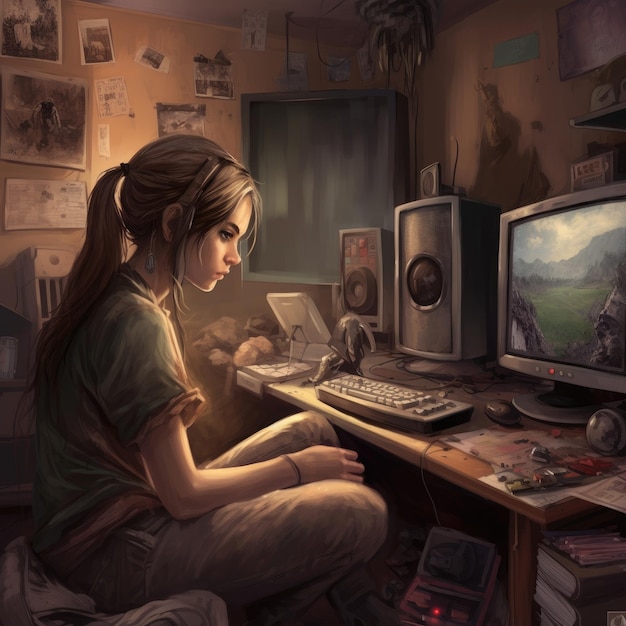
Find the location of `wall`. wall is located at coordinates (126, 146).